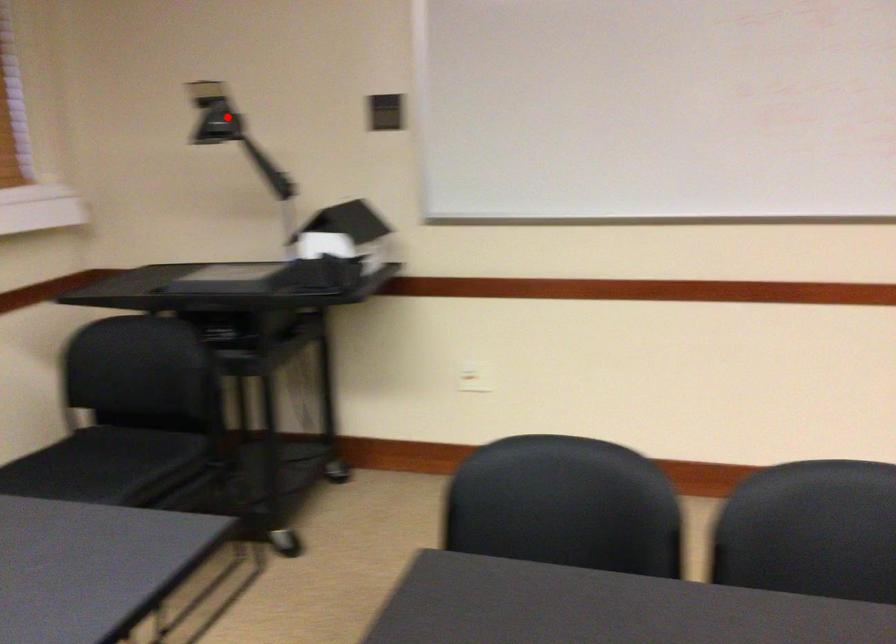
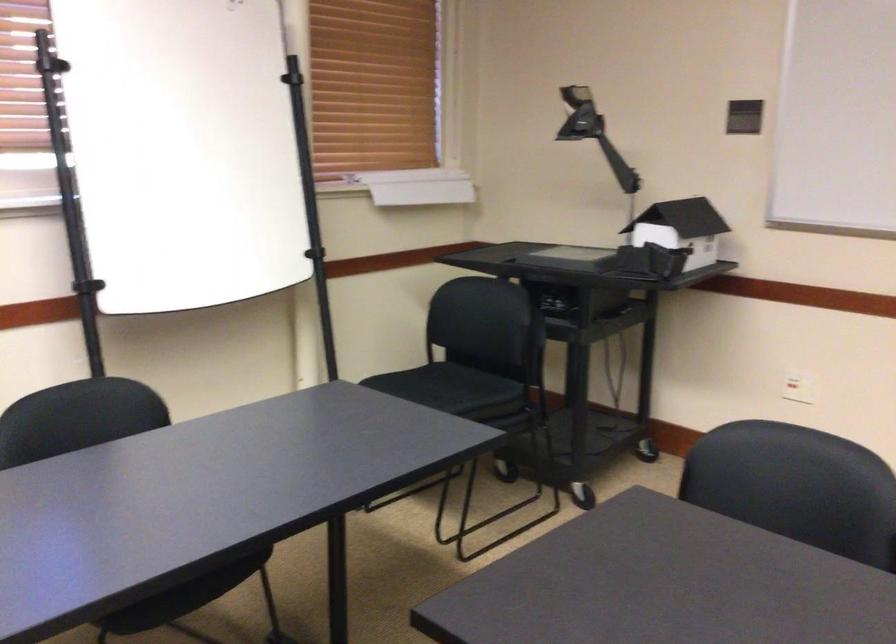
Question: I am providing you with two images of the same scene from different viewpoints. Given a red point in image1, look at the same physical point in image2. Is it:

Choices:
 (A) Closer to the viewpoint
 (B) Farther from the viewpoint

Answer: (B)